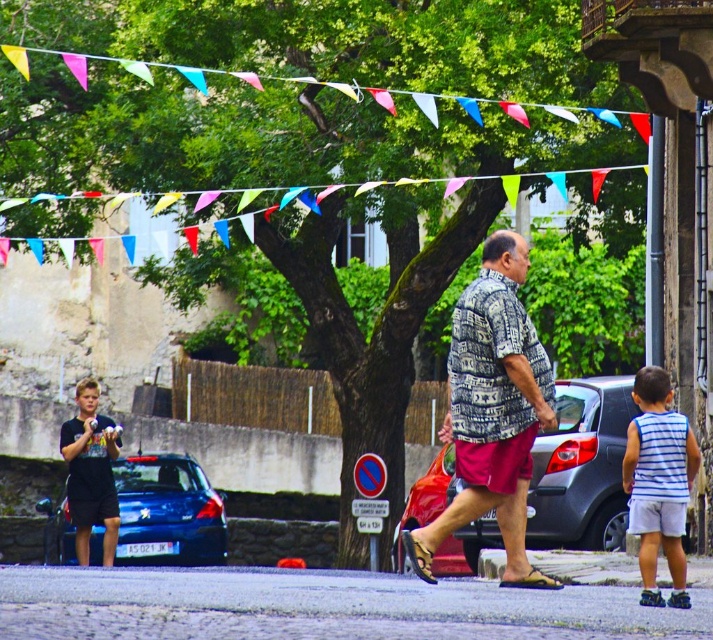
Question: Is shiny red car at center thinner than matte black shorts at left?

Choices:
 (A) no
 (B) yes

Answer: (A)

Question: Which point appears closest to the camera in this image?

Choices:
 (A) (66, 442)
 (B) (404, 522)
 (C) (550, 376)
 (D) (118, 541)

Answer: (C)

Question: Can you confirm if printed cotton shirt at center is positioned to the left of matte black shorts at left?

Choices:
 (A) yes
 (B) no

Answer: (B)

Question: From the image, what is the correct spatial relationship of shiny red car at center in relation to white striped tank top at lower right?

Choices:
 (A) above
 (B) below

Answer: (B)

Question: Among these points, which one is farthest from the camera?

Choices:
 (A) (133, 512)
 (B) (112, 531)
 (C) (563, 486)

Answer: (A)

Question: Which point is farther from the camera taking this photo?

Choices:
 (A) (503, 328)
 (B) (68, 419)

Answer: (B)